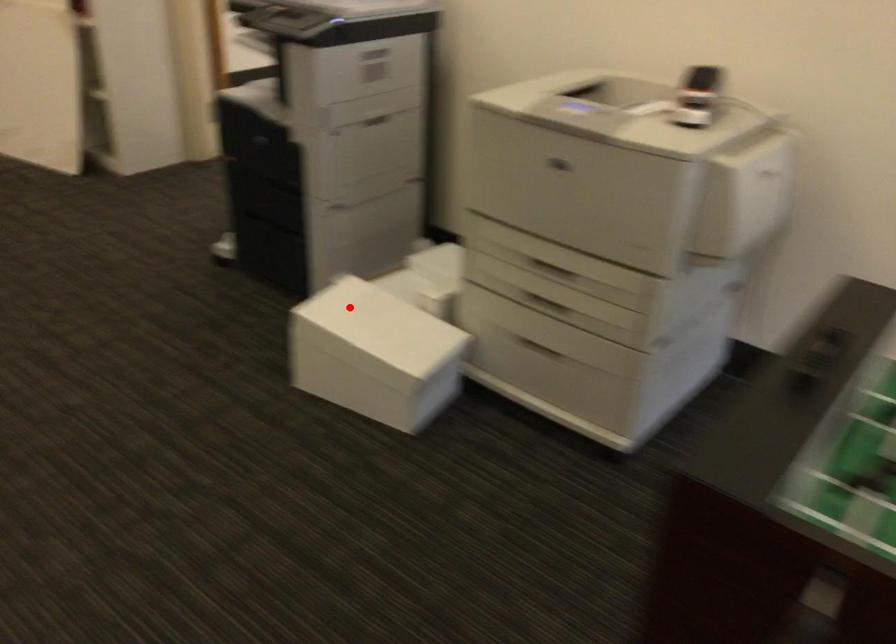
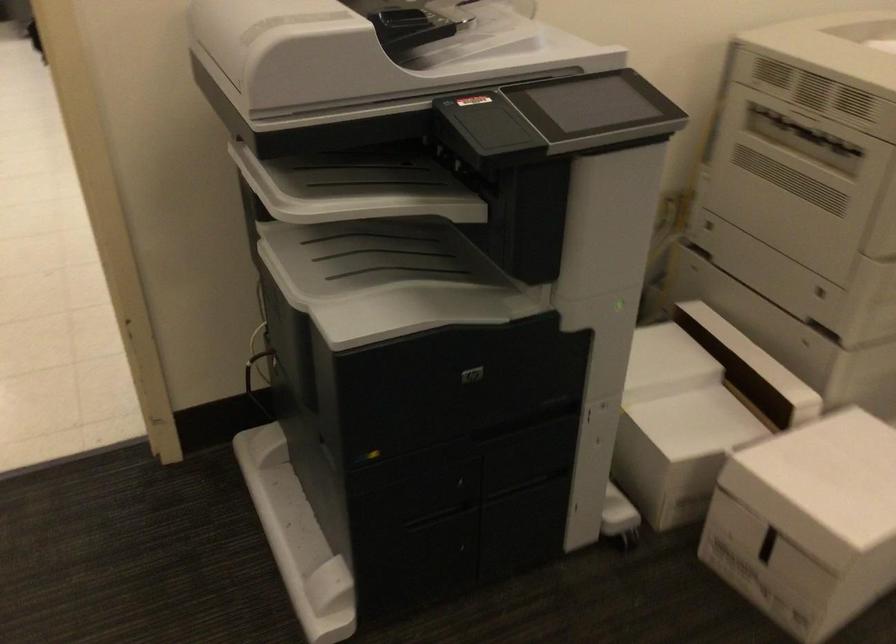
Where in the second image is the point corresponding to the highlighted location from the first image?

(822, 484)